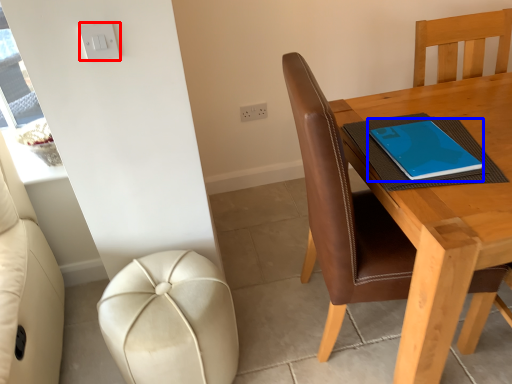
Question: Which point is closer to the camera, light switch (highlighted by a red box) or notebook (highlighted by a blue box)?

Choices:
 (A) light switch
 (B) notebook

Answer: (A)